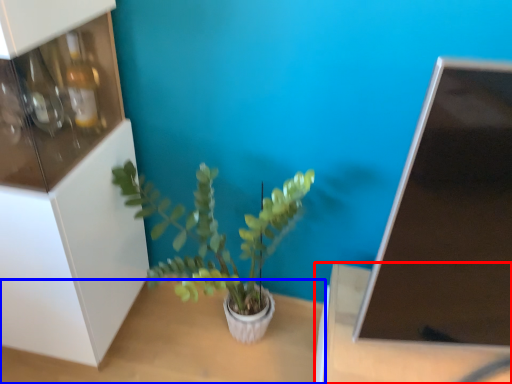
Question: Among these objects, which one is farthest to the camera, table (highlighted by a red box) or table (highlighted by a blue box)?

Choices:
 (A) table
 (B) table

Answer: (B)